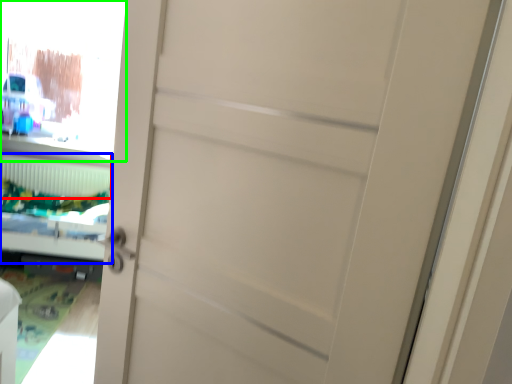
Question: Estimate the real-world distances between objects in this image. Which object is closer to radiator (highlighted by a red box), bed (highlighted by a blue box) or window screen (highlighted by a green box)?

Choices:
 (A) bed
 (B) window screen

Answer: (A)